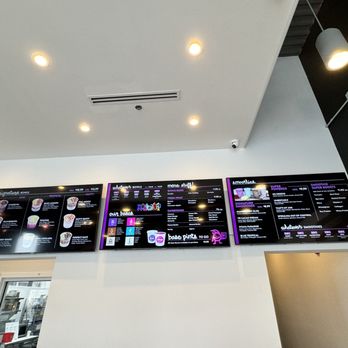
The height and width of the screenshot is (348, 348). In order to click on ceiling light in this screenshot , I will do `click(84, 129)`, `click(38, 61)`, `click(194, 122)`, `click(194, 49)`, `click(336, 60)`.